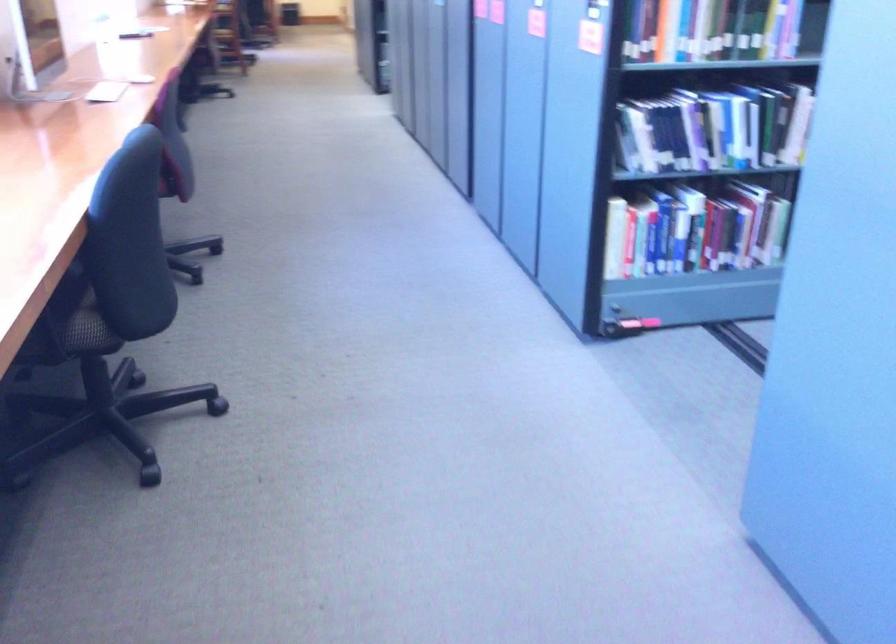
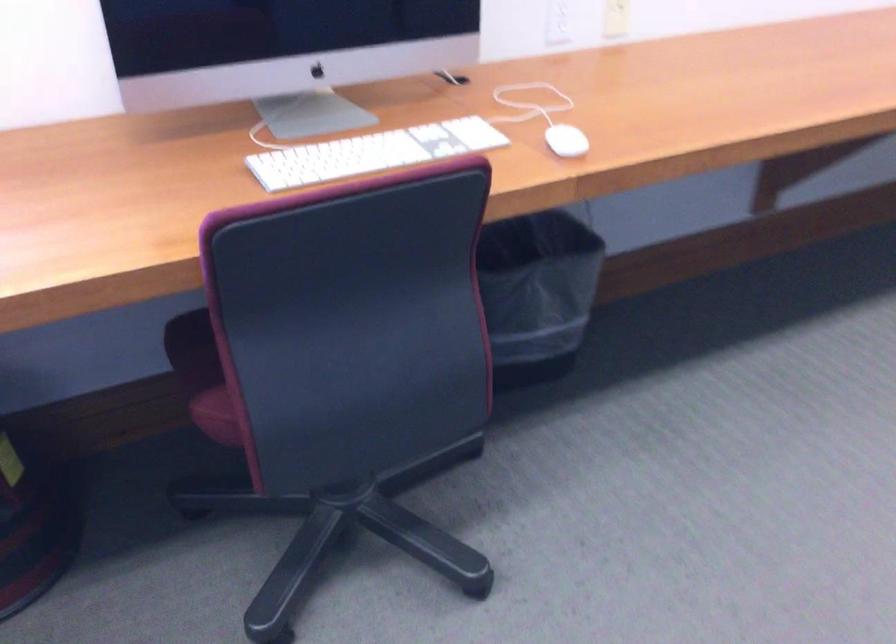
Find the pixel in the second image that matches point 164,180 in the first image.

(220, 413)